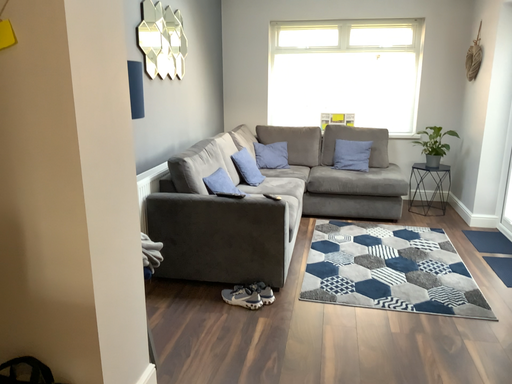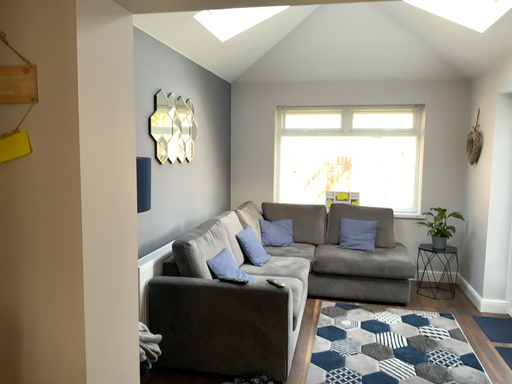
Question: How did the camera likely rotate when shooting the video?

Choices:
 (A) rotated downward
 (B) rotated upward

Answer: (B)